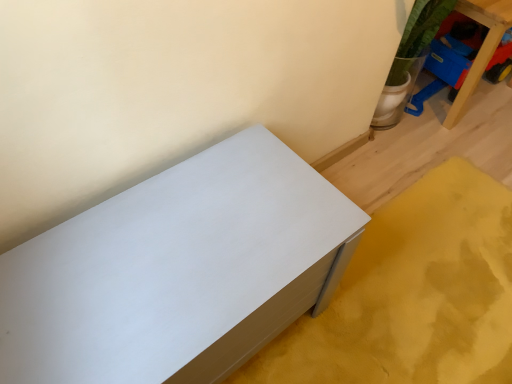
Where is `empty space that is ontop of white matte chest of drawers at lower left, the 1th furniture positioned from the left (from a real-world perspective)`? empty space that is ontop of white matte chest of drawers at lower left, the 1th furniture positioned from the left (from a real-world perspective) is located at coordinates tap(99, 293).